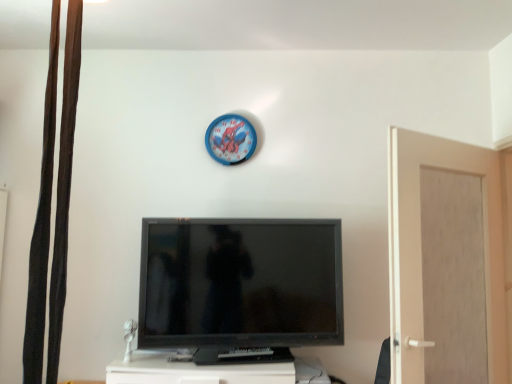
Question: In terms of height, does black fabric curtain at left look taller or shorter compared to black glossy television at center?

Choices:
 (A) short
 (B) tall

Answer: (B)

Question: From a real-world perspective, is black fabric curtain at left physically located above or below black glossy television at center?

Choices:
 (A) below
 (B) above

Answer: (B)

Question: Estimate the real-world distances between objects in this image. Which object is closer to the black fabric curtain at left?

Choices:
 (A) blue plastic clock at upper center
 (B) black glossy television at center
 (C) beige matte door at right

Answer: (B)

Question: Estimate the real-world distances between objects in this image. Which object is farther from the blue plastic clock at upper center?

Choices:
 (A) black fabric curtain at left
 (B) black glossy television at center
 (C) beige matte door at right

Answer: (A)